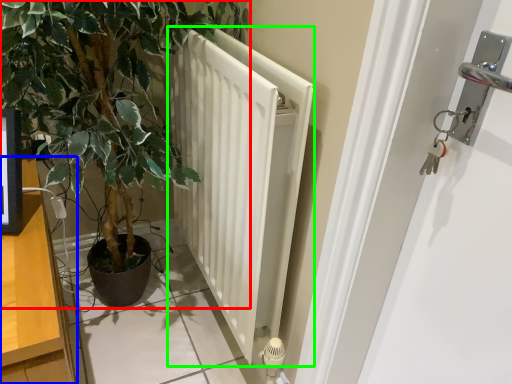
Question: Which object is the closest to the houseplant (highlighted by a red box)? Choose among these: dresser (highlighted by a blue box) or radiator (highlighted by a green box).

Choices:
 (A) dresser
 (B) radiator

Answer: (B)